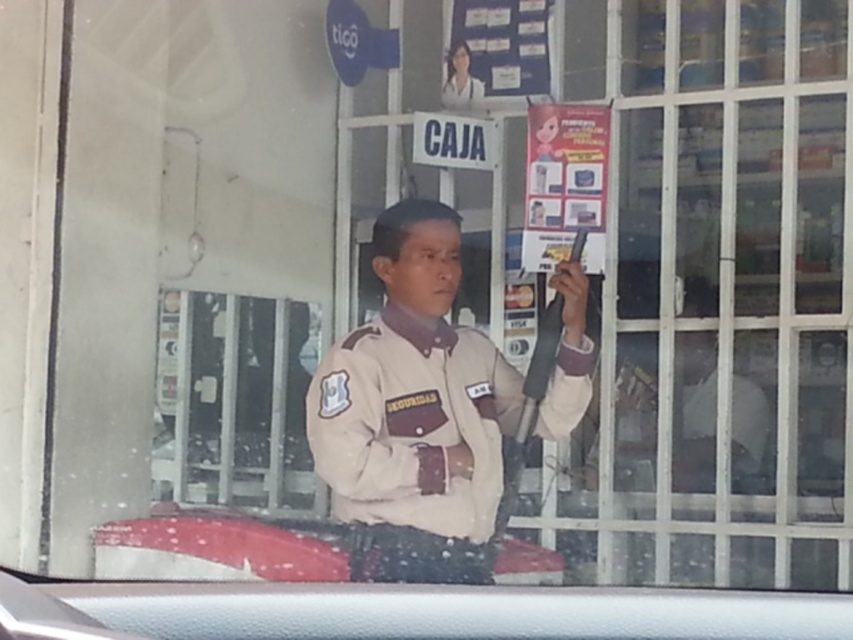
Question: Does beige fabric uniform at center appear over matte paper poster at upper center?

Choices:
 (A) yes
 (B) no

Answer: (B)

Question: Can you confirm if beige fabric uniform at center is bigger than matte paper poster at upper center?

Choices:
 (A) yes
 (B) no

Answer: (A)

Question: Can you confirm if beige fabric uniform at center is positioned to the right of matte paper poster at upper center?

Choices:
 (A) yes
 (B) no

Answer: (B)

Question: Which point is farther to the camera?

Choices:
 (A) matte paper poster at upper center
 (B) beige fabric uniform at center

Answer: (A)